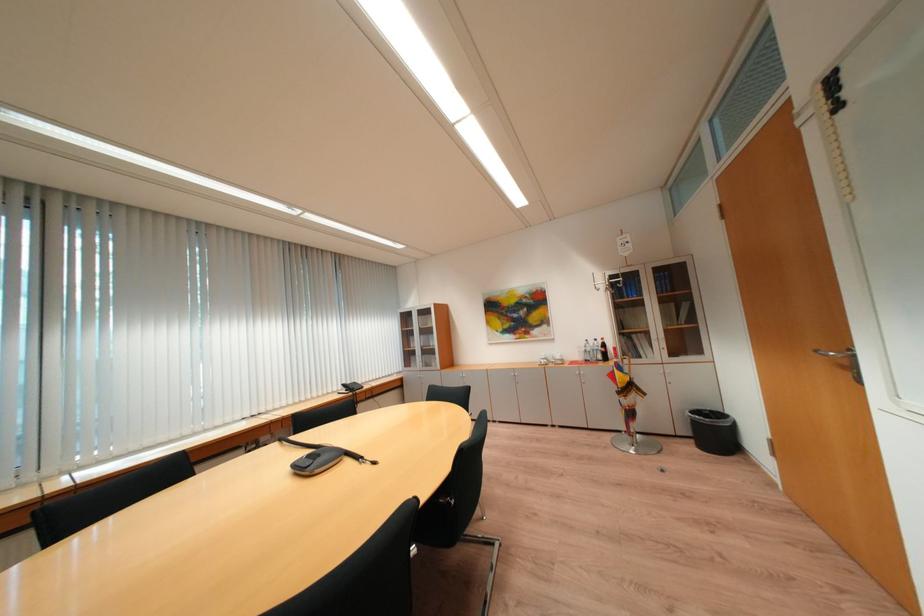
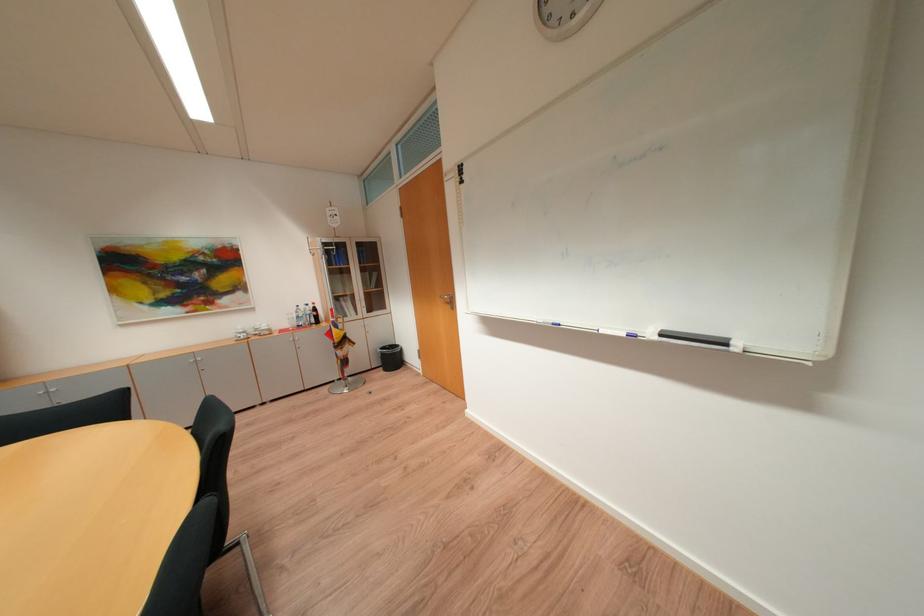
In the second image, find the point that corresponds to point 594,353 in the first image.

(307, 318)